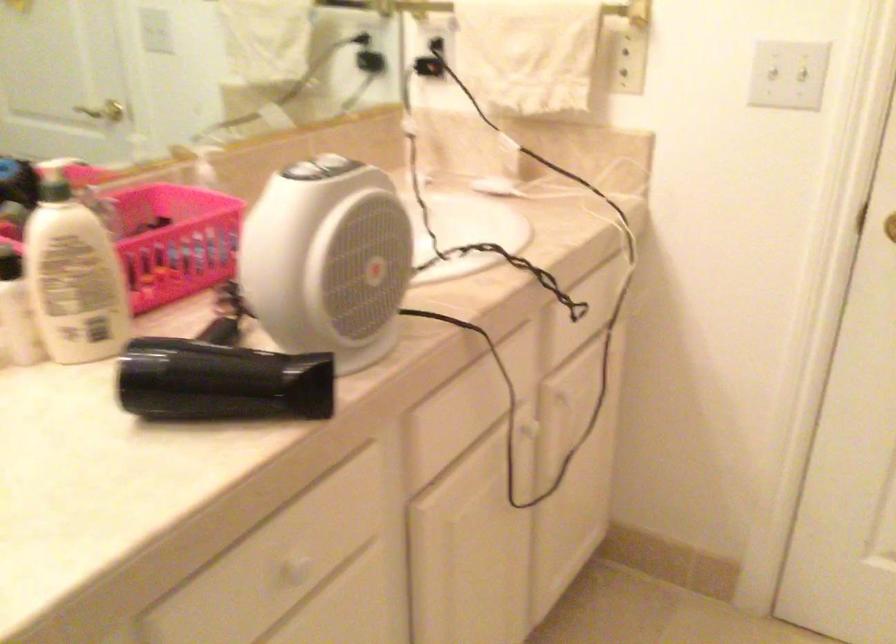
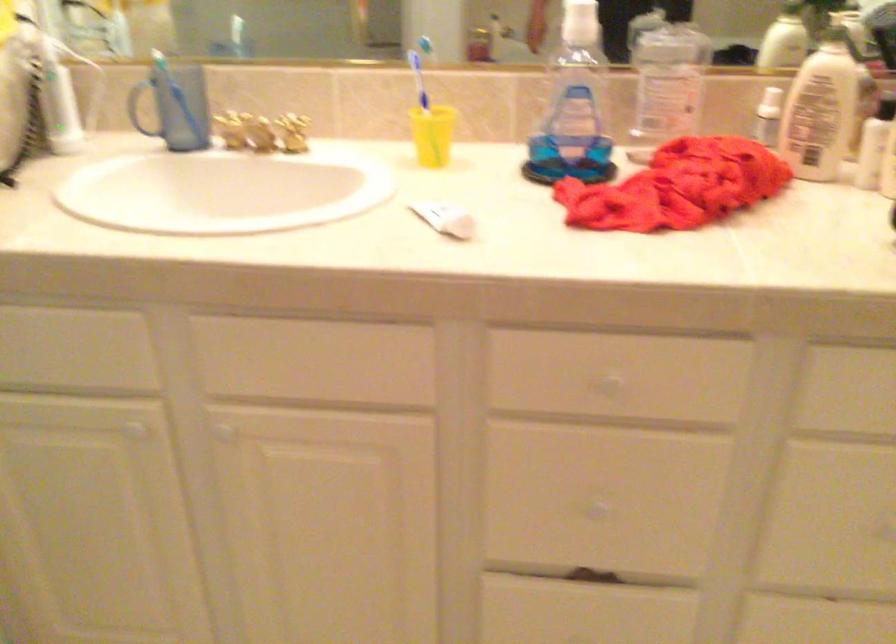
First-person continuous shooting, in which direction is the camera rotating?

The rotation direction of the camera is left-down.